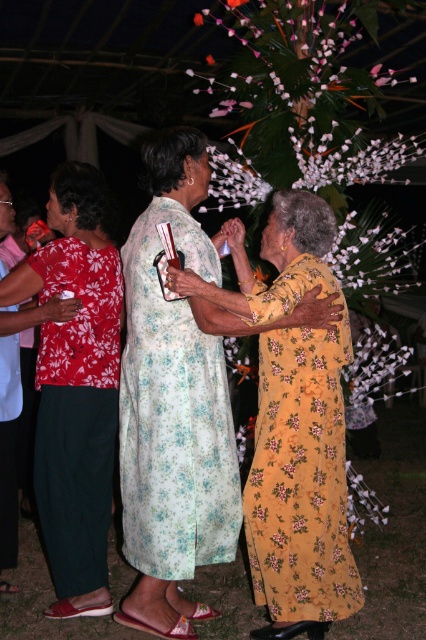
Is point (268, 445) more distant than point (348, 499)?

No, (268, 445) is in front of (348, 499).

What do you see at coordinates (299, 458) in the screenshot?
I see `yellow floral dress at center` at bounding box center [299, 458].

At what (x,y) coordinates should I click in order to perform the action: click on yellow floral dress at center. Please return your answer as a coordinate pair (x, y). Looking at the image, I should click on (299, 458).

Who is taller, floral fabric dress at center or floral fabric dress at left?

Standing taller between the two is floral fabric dress at center.

Who is more forward, (221, 396) or (81, 246)?

Point (221, 396)

Between point (224, 330) and point (66, 577), which one is positioned behind?

Point (66, 577)

Identify the location of floral fabric dress at center. This screenshot has height=640, width=426. (178, 400).

Does floral fabric dress at left appear under white floral garland at center?

Incorrect, floral fabric dress at left is not positioned below white floral garland at center.

Between point (77, 445) and point (356, 388), which one is positioned behind?

The point (356, 388) is behind.

Identify the location of floral fabric dress at left. This screenshot has height=640, width=426. (75, 387).